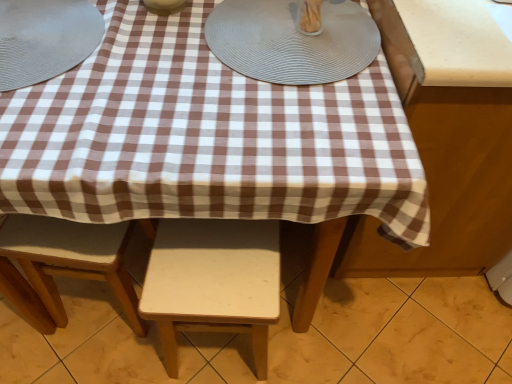
The image size is (512, 384). I want to click on vacant space that is to the left of clear glass container at upper center, placed as the first tableware when sorted from right to left, so click(248, 29).